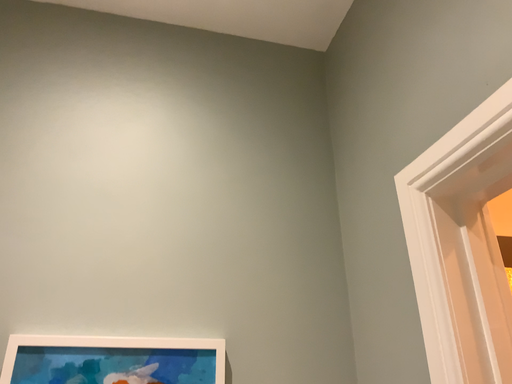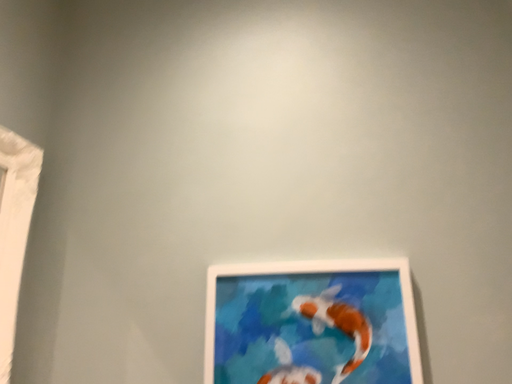
Question: Which way did the camera rotate in the video?

Choices:
 (A) rotated left
 (B) rotated right

Answer: (A)